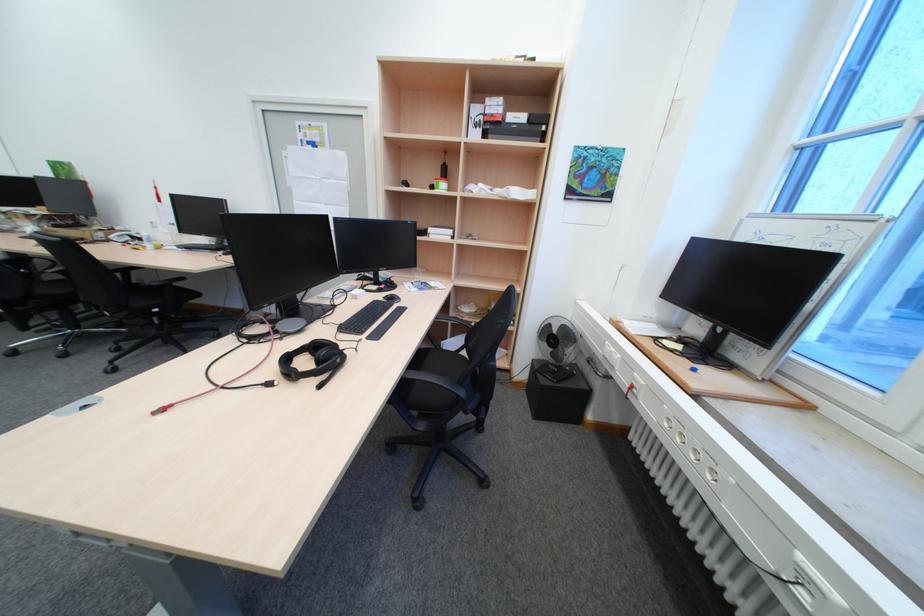
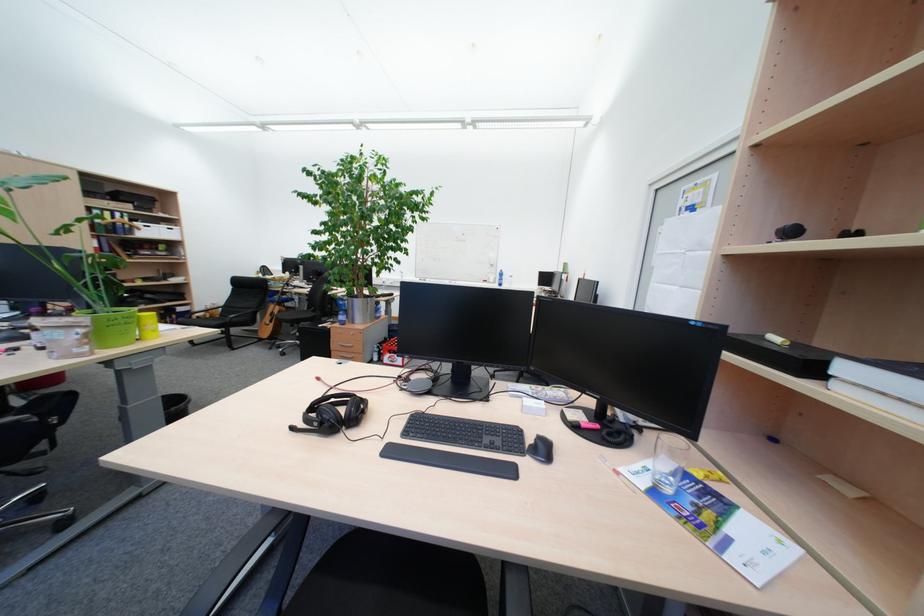
Locate, in the second image, the point that corresponds to [332,387] in the first image.

(304, 430)